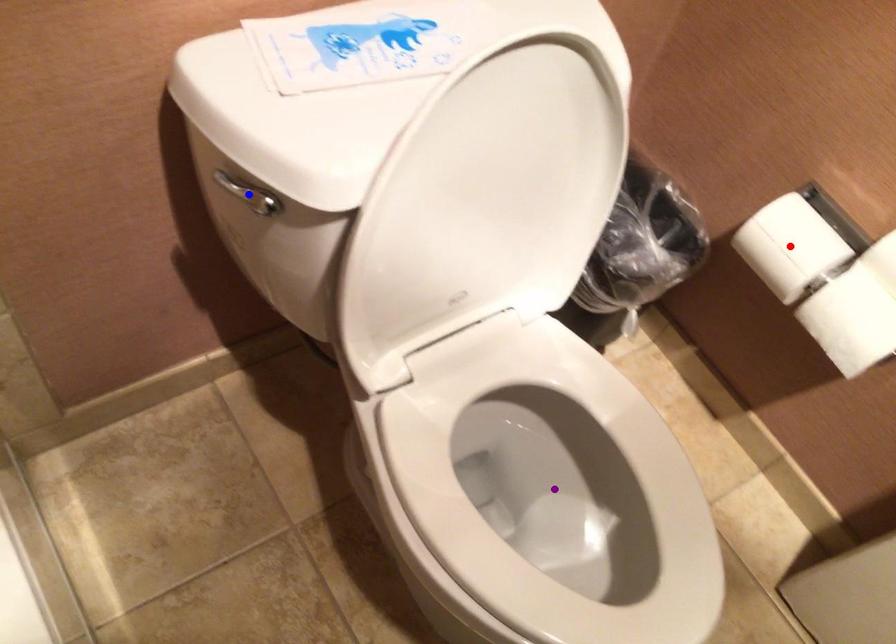
Order these from nearest to farthest:
1. blue point
2. red point
3. purple point

blue point
purple point
red point